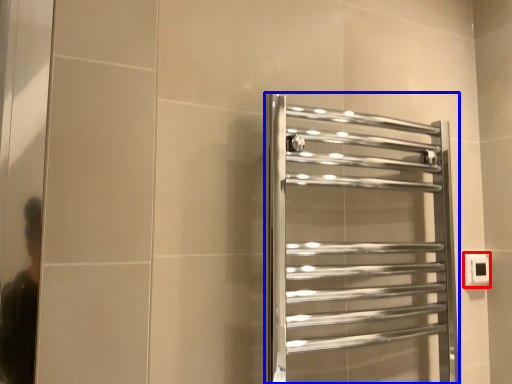
Question: Which object appears closest to the camera in this image, electric outlet (highlighted by a red box) or towel rack (highlighted by a blue box)?

Choices:
 (A) electric outlet
 (B) towel rack

Answer: (B)